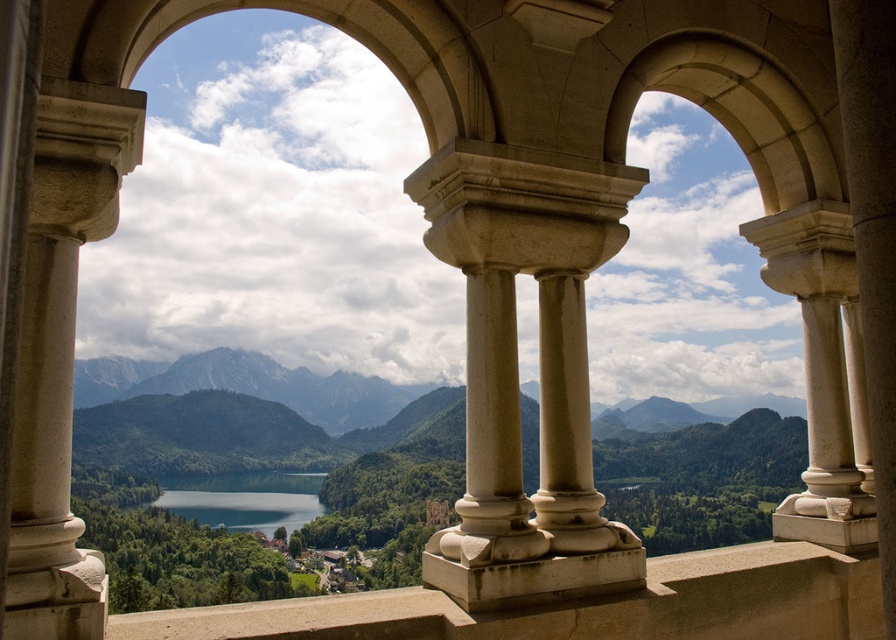
Question: Is beige stone pillars at center below shiny blue water at center?

Choices:
 (A) no
 (B) yes

Answer: (A)

Question: Is smooth stone column at left behind smooth stone ledge at center?

Choices:
 (A) no
 (B) yes

Answer: (A)

Question: Which is farther from the smooth stone ledge at center?

Choices:
 (A) smooth stone column at left
 (B) beige stone pillars at center

Answer: (A)

Question: Estimate the real-world distances between objects in this image. Which object is farther from the shiny blue water at center?

Choices:
 (A) smooth stone ledge at center
 (B) smooth stone column at left

Answer: (A)

Question: Which object is closer to the camera taking this photo?

Choices:
 (A) smooth stone ledge at center
 (B) smooth stone column at left

Answer: (B)

Question: Can you confirm if beige stone pillars at center is positioned below smooth stone ledge at center?

Choices:
 (A) no
 (B) yes

Answer: (A)